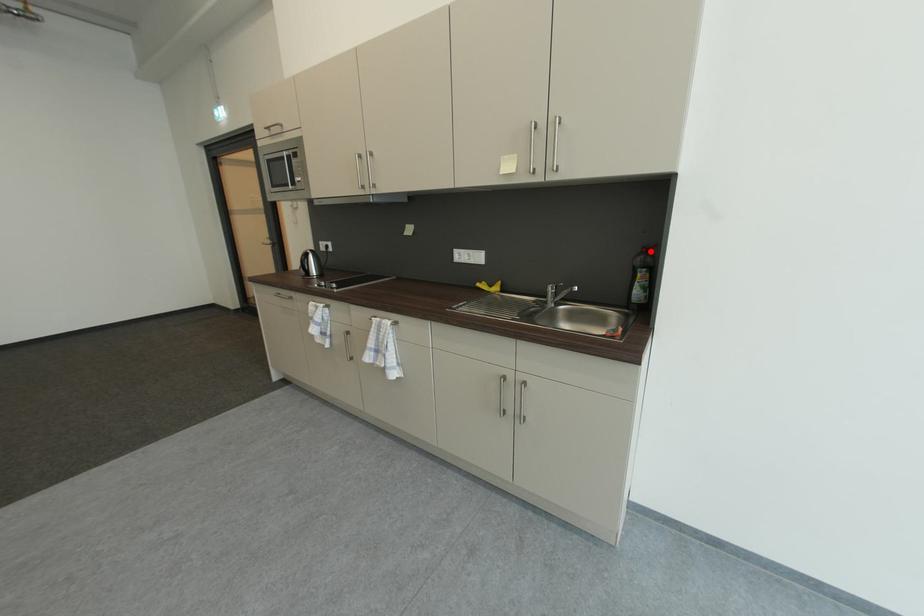
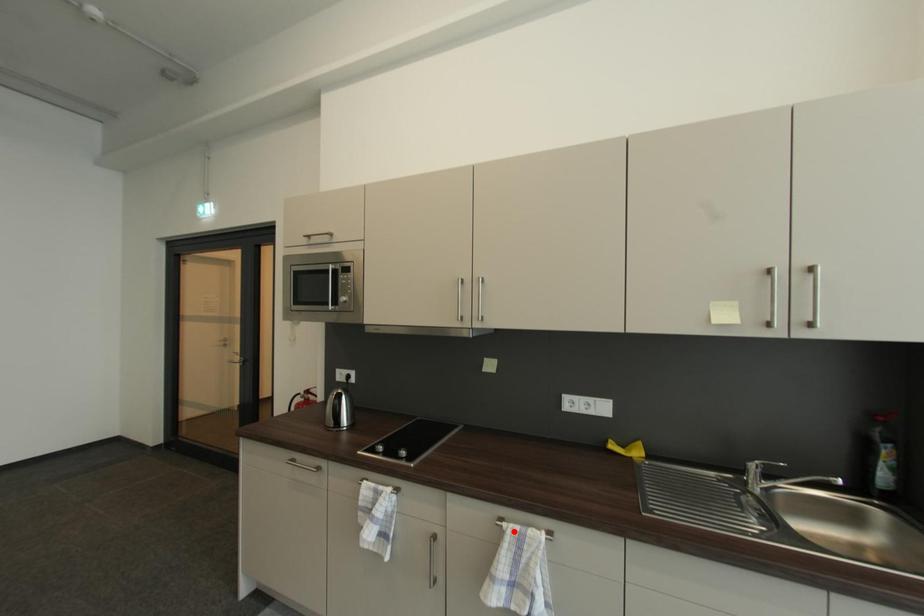
I am providing you with two images of the same scene from different viewpoints. A red point is marked on the first image and another point is marked on the second image. Is the marked point in image1 the same physical position as the marked point in image2?

No